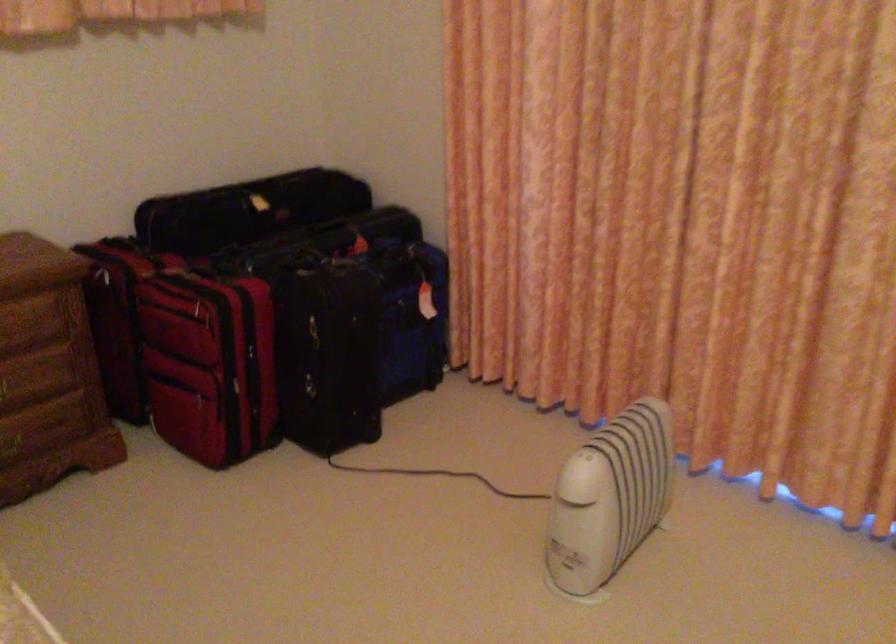
The height and width of the screenshot is (644, 896). What do you see at coordinates (202, 305) in the screenshot?
I see `the red suitcase handle` at bounding box center [202, 305].